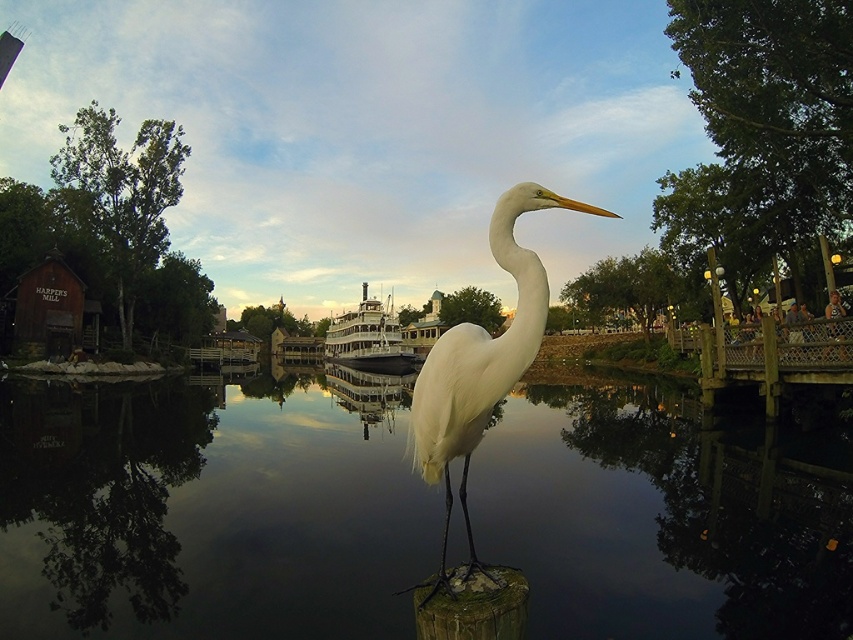
Question: Is white feathered bird at center positioned behind polished wood boat at center?

Choices:
 (A) no
 (B) yes

Answer: (A)

Question: Does white feathered bird at center appear on the right side of polished wood boat at center?

Choices:
 (A) yes
 (B) no

Answer: (A)

Question: Which of the following is the closest to the observer?

Choices:
 (A) polished wood boat at center
 (B) white feathered bird at center
 (C) transparent water at center

Answer: (B)

Question: Among these points, which one is farthest from the camera?

Choices:
 (A) (397, 352)
 (B) (218, 573)

Answer: (A)

Question: From the image, what is the correct spatial relationship of transparent water at center in relation to polished wood boat at center?

Choices:
 (A) left
 (B) right

Answer: (B)

Question: Estimate the real-world distances between objects in this image. Which object is farther from the polished wood boat at center?

Choices:
 (A) transparent water at center
 (B) white feathered bird at center

Answer: (B)